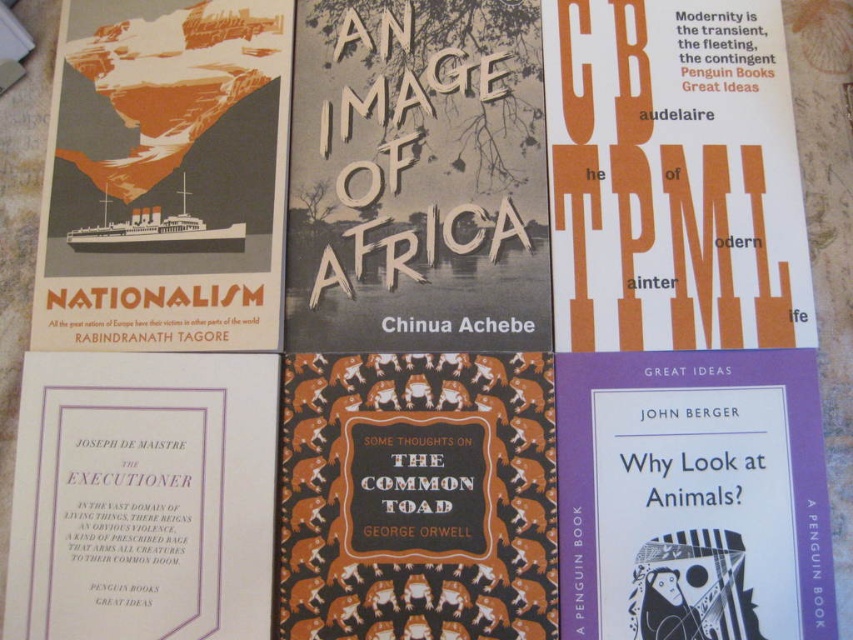
You are an art curator arranging an exhibition. You have two items to place on a wall display. The items are the brown textured paper at center and the matte orange poster at upper left. Based on their sizes, which item should you place higher up to ensure both are visible to visitors standing at eye level?

The brown textured paper at center has a smaller size compared to matte orange poster at upper left. To ensure both are visible at eye level, place the smaller brown textured paper at center higher up so it can be seen above the larger matte orange poster at upper left.

You are organizing a library shelf and need to place the white paper at upper right and the purple paperback book at bottom right. According to their positions in the image, which object should be placed to the left side of the shelf?

The white paper at upper right should be placed to the left side of the shelf because it is positioned to the left of the purple paperback book at bottom right in the image.

You are a librarian organizing books on a shelf. You have two purple books to place next to each other. The purple paperback book at bottom right and the purple paper book at bottom left. Can you fit them side by side on a shelf that is 12 inches wide?

The distance between the purple paperback book at bottom right and purple paper book at bottom left is 11.78 inches, so they can fit side by side on a 12 inch wide shelf since the total width required is less than the shelf width.